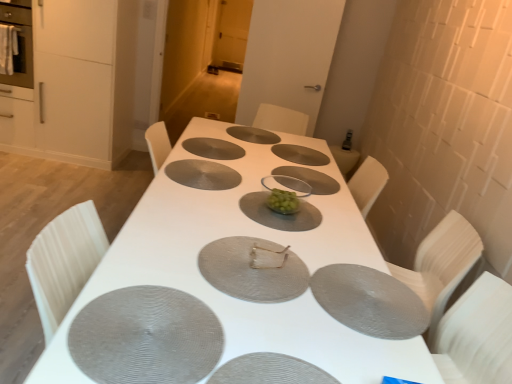
The height and width of the screenshot is (384, 512). I want to click on vacant region below gray textured placemat at center, the 5th pizza pan in the front-to-back sequence (from a real-world perspective), so click(202, 170).